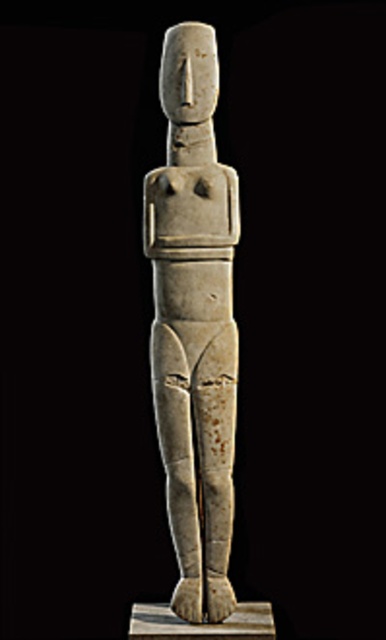
You are an archaeologist examining the image of the ancient stone artifacts. You need to determine which object has a smaller width between the white stone figure at center and the white stone pillar at center. Which one is it?

The white stone figure at center is thinner than the white stone pillar at center, so the white stone figure at center has a smaller width.

You are an archaeologist who needs to transport the white stone figure at center and the white stone pillar at center. The transportation box you have can only accommodate items within 10 inches in length. Can both items be placed in the same box without exceeding the length limit?

The distance between the white stone figure at center and white stone pillar at center is 9.33 inches, so they can be placed in the same box as the total length required is within the 10 inches limit.

You are an archaeologist examining the stone figure. The point marked at coordinates [194,349] is part of the figure. Where on the figure is this point located?

The point marked at coordinates [194,349] is located on the white stone figure at center.